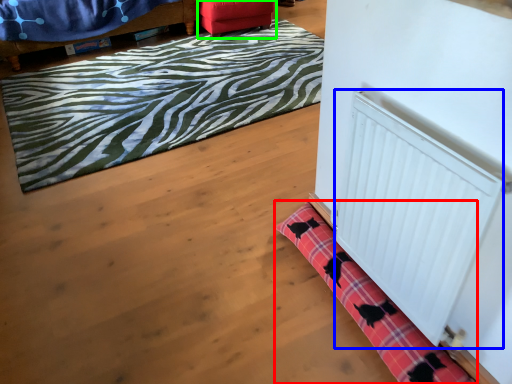
Question: Considering the real-world distances, which object is farthest from bath mat (highlighted by a red box)? radiator (highlighted by a blue box) or furniture (highlighted by a green box)?

Choices:
 (A) radiator
 (B) furniture

Answer: (B)